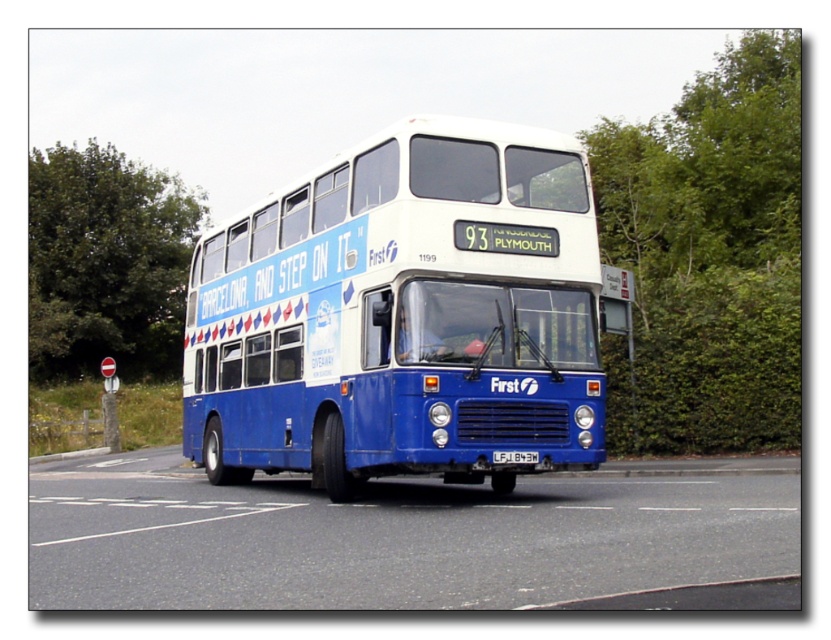
Question: Considering the relative positions of green leafy tree at left and white plastic license plate at center in the image provided, where is green leafy tree at left located with respect to white plastic license plate at center?

Choices:
 (A) above
 (B) below

Answer: (A)

Question: Which object is closer to the camera taking this photo?

Choices:
 (A) white plastic license plate at center
 (B) blue metallic bus at center
 (C) green leafy tree at left

Answer: (B)

Question: Is the position of blue metallic bus at center less distant than that of green leafy tree at left?

Choices:
 (A) yes
 (B) no

Answer: (A)

Question: Considering the real-world distances, which object is farthest from the white plastic license plate at center?

Choices:
 (A) green leafy tree at left
 (B) blue metallic bus at center

Answer: (A)

Question: Which object is the closest to the white plastic license plate at center?

Choices:
 (A) green leafy tree at left
 (B) blue metallic bus at center

Answer: (B)

Question: From the image, what is the correct spatial relationship of blue metallic bus at center in relation to green leafy tree at left?

Choices:
 (A) above
 (B) below

Answer: (B)